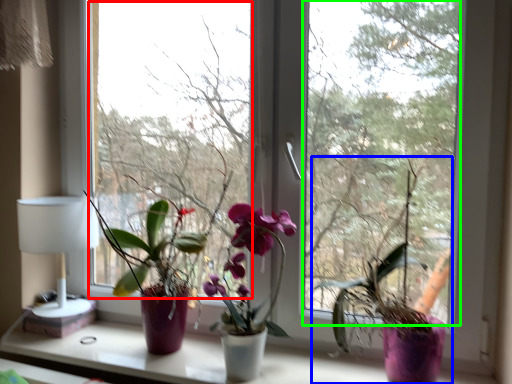
Question: Which object is the farthest from window screen (highlighted by a red box)? Choose among these: houseplant (highlighted by a blue box) or window screen (highlighted by a green box).

Choices:
 (A) houseplant
 (B) window screen

Answer: (A)